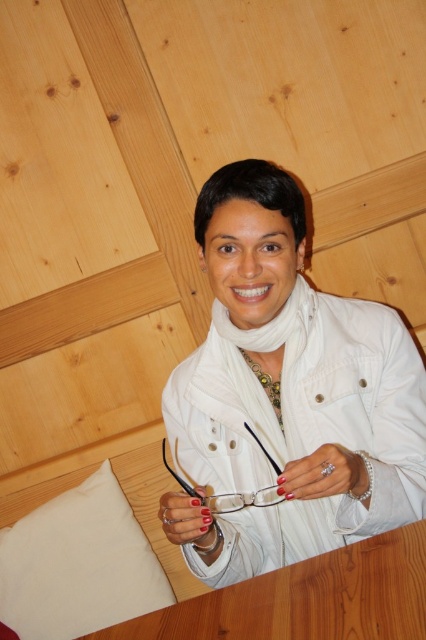
You are standing in a room with a wooden table at center. If you want to place a 25 inch wide painting on the table, will it fit?

The distance between you and the wooden table at center is 27.23 inches. Since the painting is 25 inches wide, it will fit on the table as the table is wider than the painting.

You are a photographer setting up a shot in this room. You want to place a small vase at the exact location of point (307, 598). Where should you place the vase?

Place the vase on the wooden table at center, as point (307, 598) is on wooden table at center.